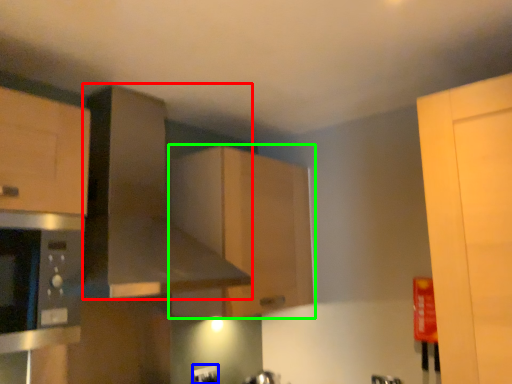
Question: Which object is positioned closest to exhaust hood (highlighted by a red box)? Select from electric outlet (highlighted by a blue box) and cabinetry (highlighted by a green box).

Choices:
 (A) electric outlet
 (B) cabinetry

Answer: (B)